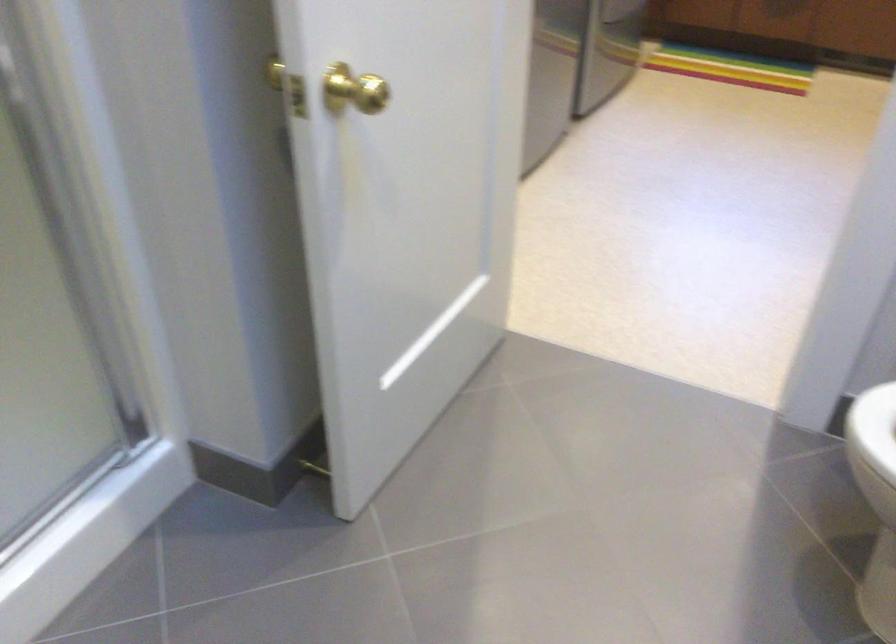
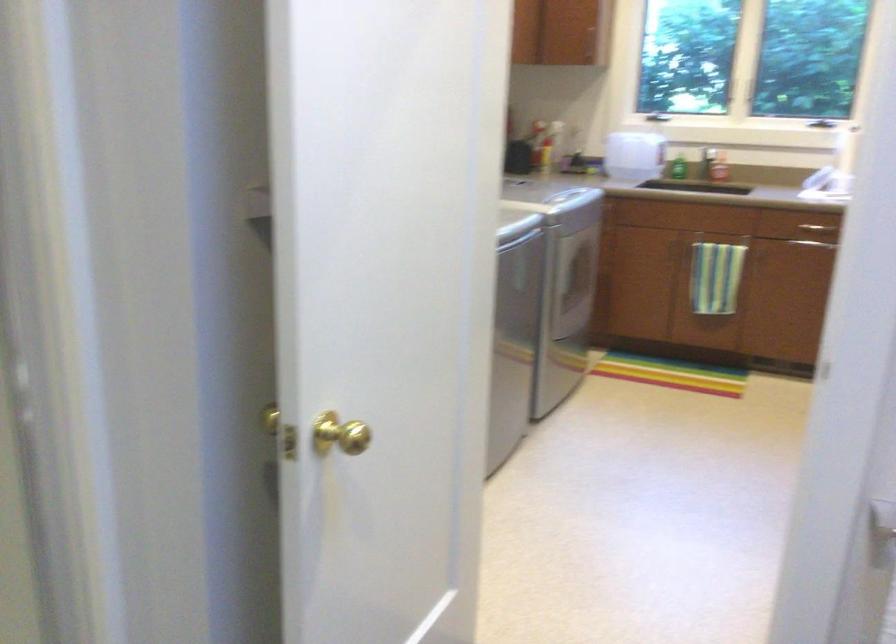
Question: The first image is from the beginning of the video and the second image is from the end. How did the camera likely rotate when shooting the video?

Choices:
 (A) Left
 (B) Right
 (C) Up
 (D) Down

Answer: (C)